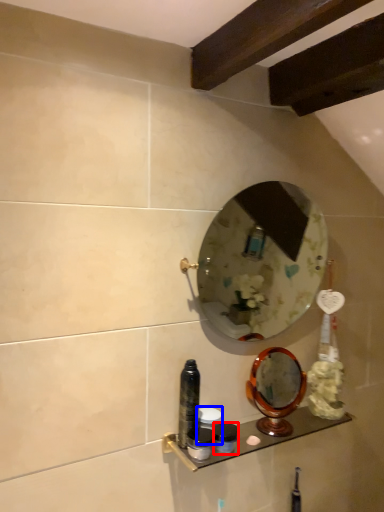
Question: Among these objects, which one is nearest to the camera, toiletry (highlighted by a red box) or toiletry (highlighted by a blue box)?

Choices:
 (A) toiletry
 (B) toiletry

Answer: (A)